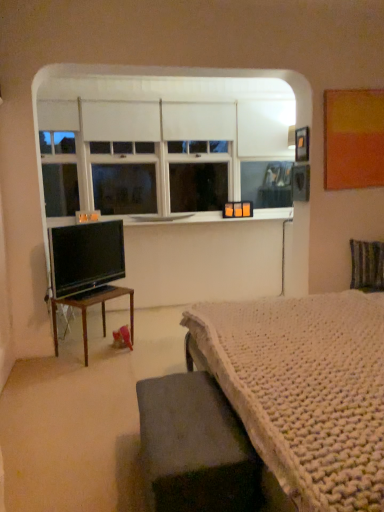
Question: Would you say wooden table at left, placed as the 1th table when sorted from back to front, is to the left or to the right of dark gray fabric ottoman at lower center, the first table viewed from the front, in the picture?

Choices:
 (A) right
 (B) left

Answer: (B)

Question: Is wooden table at left, which appears as the second table when viewed from the right, in front of or behind dark gray fabric ottoman at lower center, the 1th table positioned from the right, in the image?

Choices:
 (A) front
 (B) behind

Answer: (B)

Question: Estimate the real-world distances between objects in this image. Which object is farther from the white smooth window sill at center?

Choices:
 (A) white matte window at upper center
 (B) wooden table at left, which is counted as the first table, starting from the left
 (C) black glossy tv at left
 (D) dark gray fabric ottoman at lower center, the first table viewed from the front
 (E) striped fabric swivel chair at right

Answer: (D)

Question: Estimate the real-world distances between objects in this image. Which object is farther from the white matte window at upper center?

Choices:
 (A) dark gray fabric ottoman at lower center, the second table viewed from the left
 (B) wooden table at left, placed as the 1th table when sorted from back to front
 (C) black glossy tv at left
 (D) striped fabric swivel chair at right
 (E) white smooth window sill at center

Answer: (A)